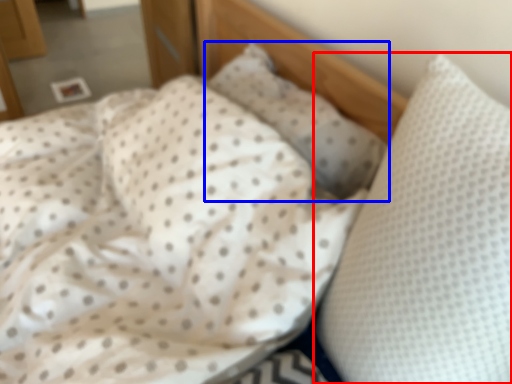
Question: Which of the following is the farthest to the observer, pillow (highlighted by a red box) or pillow (highlighted by a blue box)?

Choices:
 (A) pillow
 (B) pillow

Answer: (B)